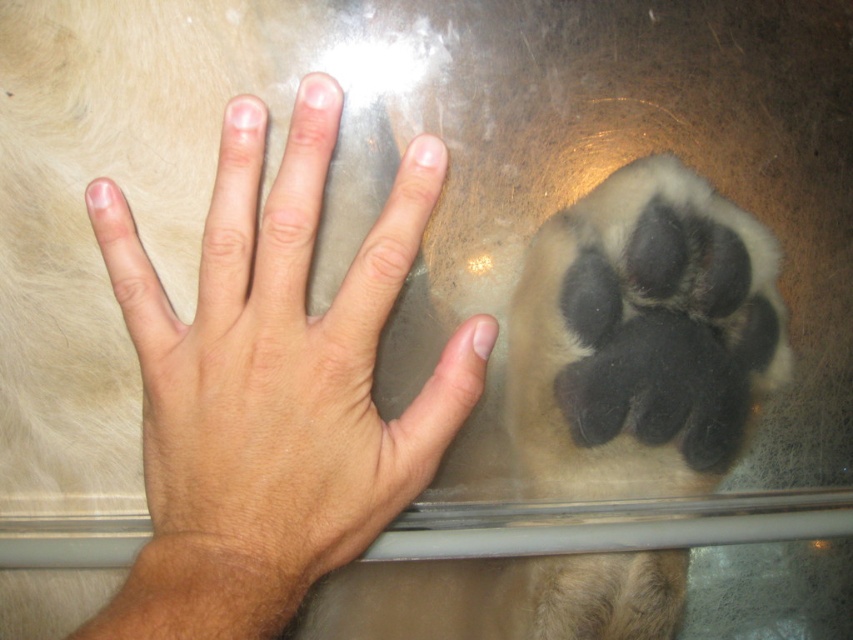
You are a researcher studying animal behavior. You observe a human hand and a dog paw interacting through a transparent surface. The human hand is labeled as light skin tone flesh at center. Can you determine the spatial relationship between the hand and the paw based on their positions?

The light skin tone flesh at center is located at point (280, 364), so the dog paw is positioned directly opposite the hand on the other side of the transparent surface.

You are a photographer trying to capture a closeup of the hand and paw interaction. The camera is currently positioned at point [225,355]. To ensure the subject is in focus, you need to adjust the focus distance. What should the focus distance be set to in inches?

The focus distance should be set to 19.79 inches because the point [225,355] and the camera are 19.79 inches apart from each other.

Looking at this image, you are a security camera observing the scene. You notice the light skin tone flesh at center and the soft fur paw at center. Which object is nearer to you?

The light skin tone flesh at center is closer to the viewer than the soft fur paw at center.